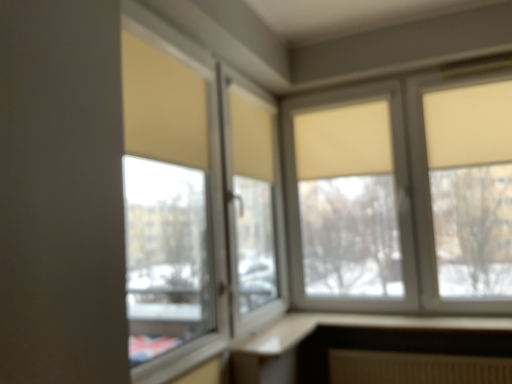
Question: Does beige fabric curtain at center lie in front of matte beige roller blinds at upper right, which is counted as the second window, starting from the left?

Choices:
 (A) no
 (B) yes

Answer: (A)

Question: Can you confirm if beige fabric curtain at center is positioned to the right of matte beige roller blinds at upper right, placed as the first window when sorted from back to front?

Choices:
 (A) yes
 (B) no

Answer: (B)

Question: Is beige fabric curtain at center oriented towards matte beige roller blinds at upper right, which is counted as the second window, starting from the left?

Choices:
 (A) no
 (B) yes

Answer: (B)

Question: Is beige fabric curtain at center smaller than matte beige roller blinds at upper right, which is counted as the second window, starting from the left?

Choices:
 (A) yes
 (B) no

Answer: (A)

Question: Is beige fabric curtain at center bigger than matte beige roller blinds at upper right, which is counted as the second window, starting from the left?

Choices:
 (A) no
 (B) yes

Answer: (A)

Question: Considering the relative positions of beige fabric curtain at center and matte beige roller blinds at upper right, which is counted as the 2th window, starting from the front, in the image provided, is beige fabric curtain at center behind matte beige roller blinds at upper right, which is counted as the 2th window, starting from the front,?

Choices:
 (A) no
 (B) yes

Answer: (B)

Question: Considering the relative sizes of matte beige roller blinds at upper right, which is counted as the 2th window, starting from the front, and beige fabric curtain at center in the image provided, is matte beige roller blinds at upper right, which is counted as the 2th window, starting from the front, smaller than beige fabric curtain at center?

Choices:
 (A) no
 (B) yes

Answer: (A)

Question: From a real-world perspective, is matte beige roller blinds at upper right, placed as the first window when sorted from back to front, physically below beige fabric curtain at center?

Choices:
 (A) yes
 (B) no

Answer: (A)

Question: From the image's perspective, is matte beige roller blinds at upper right, which is counted as the 2th window, starting from the front, located above beige fabric curtain at center?

Choices:
 (A) yes
 (B) no

Answer: (B)

Question: Does matte beige roller blinds at upper right, which is the 1th window from right to left, come behind beige fabric curtain at center?

Choices:
 (A) no
 (B) yes

Answer: (A)

Question: Does matte beige roller blinds at upper right, placed as the first window when sorted from back to front, turn towards beige fabric curtain at center?

Choices:
 (A) no
 (B) yes

Answer: (B)

Question: Is matte beige roller blinds at upper right, which is the 1th window from right to left, to the right of beige fabric curtain at center from the viewer's perspective?

Choices:
 (A) yes
 (B) no

Answer: (A)

Question: Does matte glass window at center, the 1th window from the front, have a lesser width compared to beige fabric curtain at center?

Choices:
 (A) no
 (B) yes

Answer: (A)